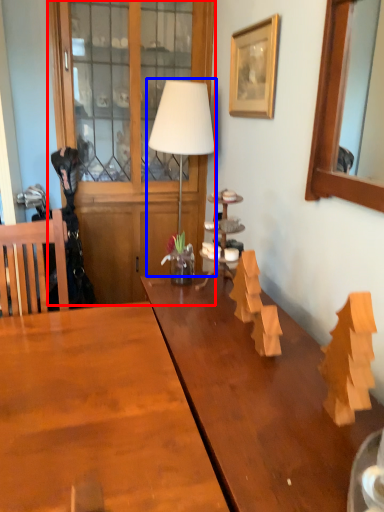
Question: Among these objects, which one is nearest to the camera, dresser (highlighted by a red box) or table lamp (highlighted by a blue box)?

Choices:
 (A) dresser
 (B) table lamp

Answer: (B)